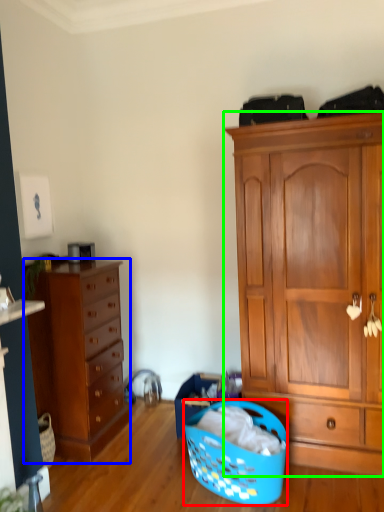
Question: Based on their relative distances, which object is nearer to picnic basket (highlighted by a red box)? Choose from chest of drawers (highlighted by a blue box) and cabinetry (highlighted by a green box).

Choices:
 (A) chest of drawers
 (B) cabinetry

Answer: (B)